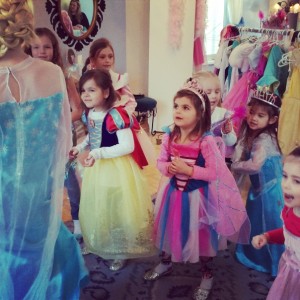
Locate an element on the screen. This screenshot has width=300, height=300. mirror is located at coordinates (90, 5).